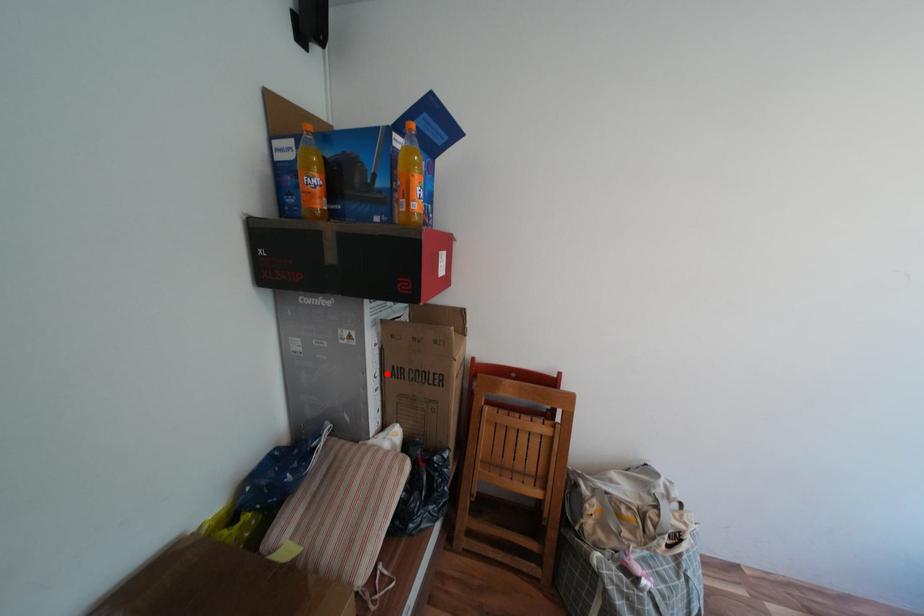
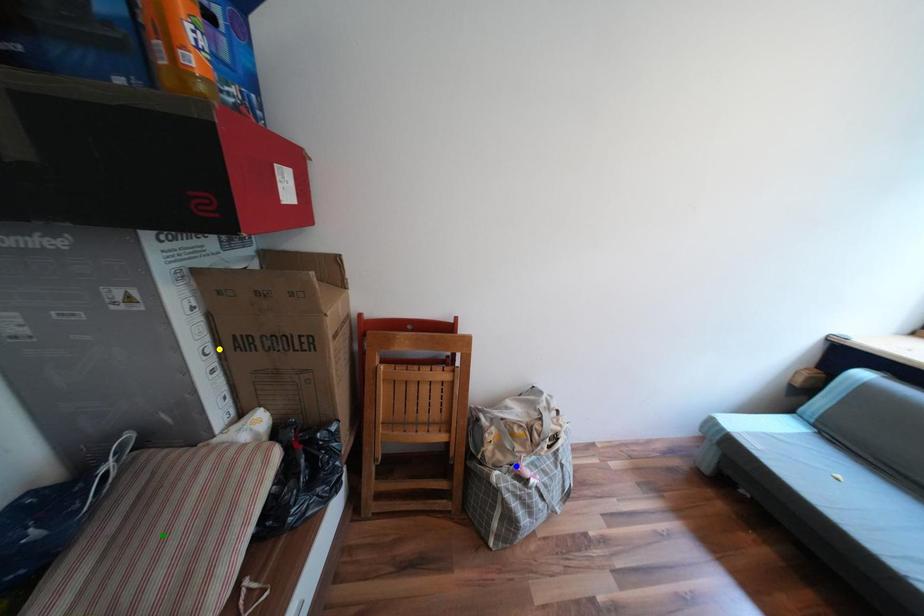
Question: I am providing you with two images of the same scene from different viewpoints. A red point is marked on the first image. You are given multiple points on the second image. Which point in image 2 is actually the same real-world point as the red point in image 1?

Choices:
 (A) yellow point
 (B) green point
 (C) blue point

Answer: (A)